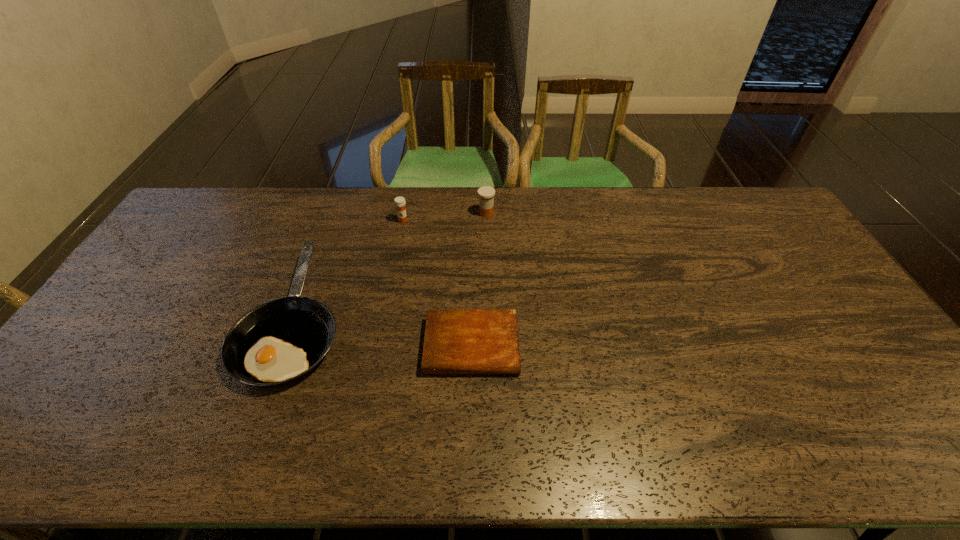
Locate an element on the screen. the right medicine is located at coordinates (486, 194).

Where is `the third object from right to left`? This screenshot has width=960, height=540. the third object from right to left is located at coordinates [x=400, y=202].

This screenshot has height=540, width=960. In order to click on frying pan in this screenshot , I will do `click(280, 340)`.

Locate an element on the screen. Image resolution: width=960 pixels, height=540 pixels. the second shortest object is located at coordinates (280, 340).

Where is `Bible`? The width and height of the screenshot is (960, 540). Bible is located at coordinates (457, 341).

Find the location of a particular element. Image resolution: width=960 pixels, height=540 pixels. vacant space located on the label of the right medicine is located at coordinates (392, 213).

The image size is (960, 540). Identify the location of blank area located 0.210m on the label of the right medicine. (420, 213).

Locate an element on the screen. free region located 0.090m on the label of the right medicine is located at coordinates (453, 213).

I want to click on vacant space situated on the label side of the left medicine, so click(396, 257).

Locate an element on the screen. The height and width of the screenshot is (540, 960). free space located 0.050m on the front of the frying pan is located at coordinates (260, 414).